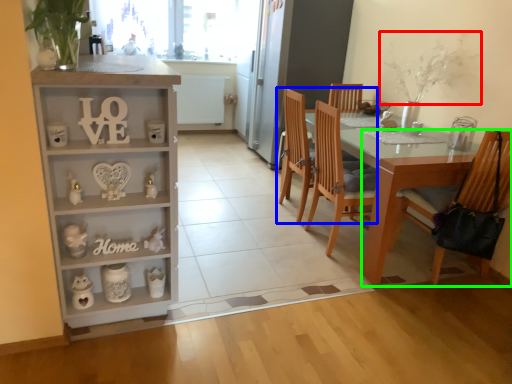
Question: Considering the real-world distances, which object is farthest from plant (highlighted by a red box)? chair (highlighted by a blue box) or chair (highlighted by a green box)?

Choices:
 (A) chair
 (B) chair

Answer: (B)